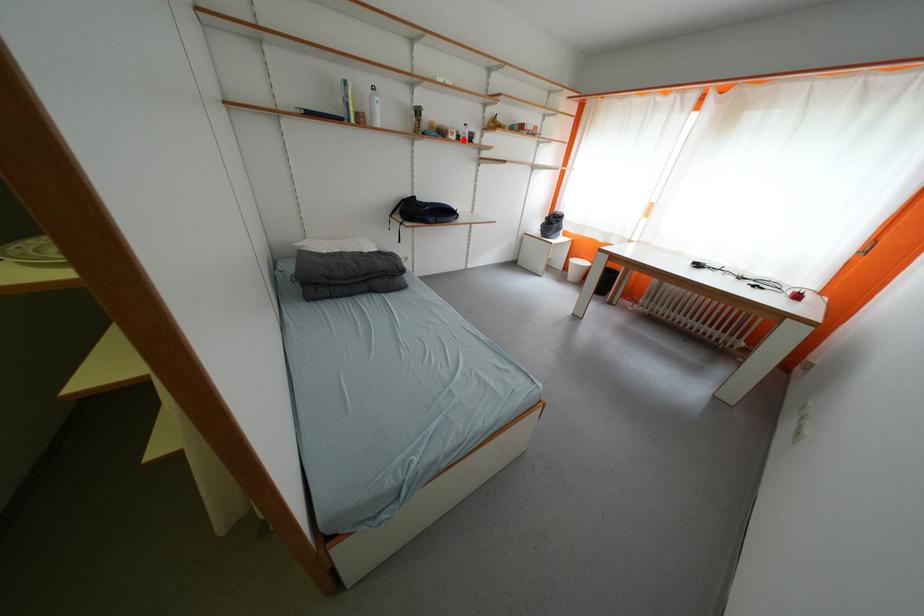
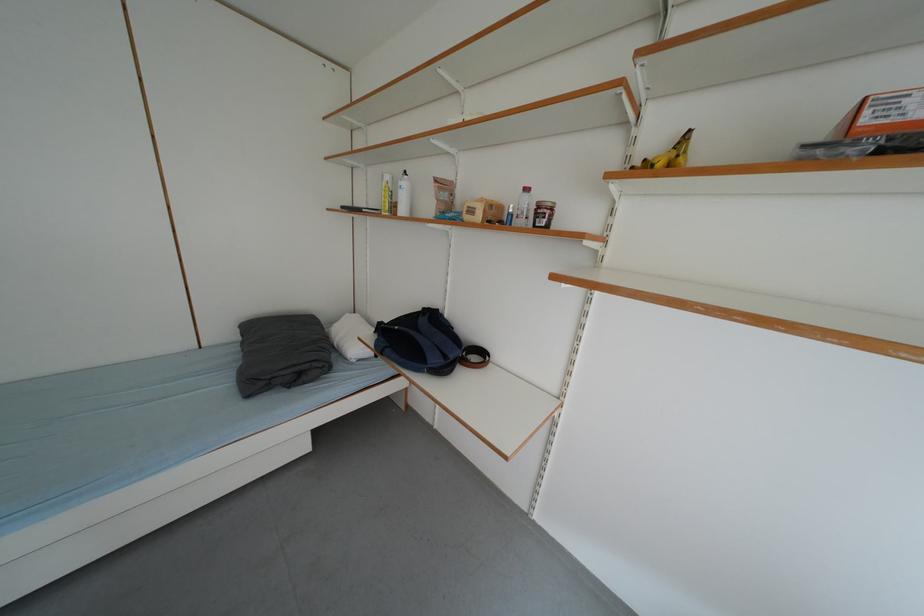
Question: I am providing you with two images of the same scene from different viewpoints. Given a red point in image1, look at the same physical point in image2. Is it:

Choices:
 (A) Closer to the viewpoint
 (B) Farther from the viewpoint

Answer: (B)